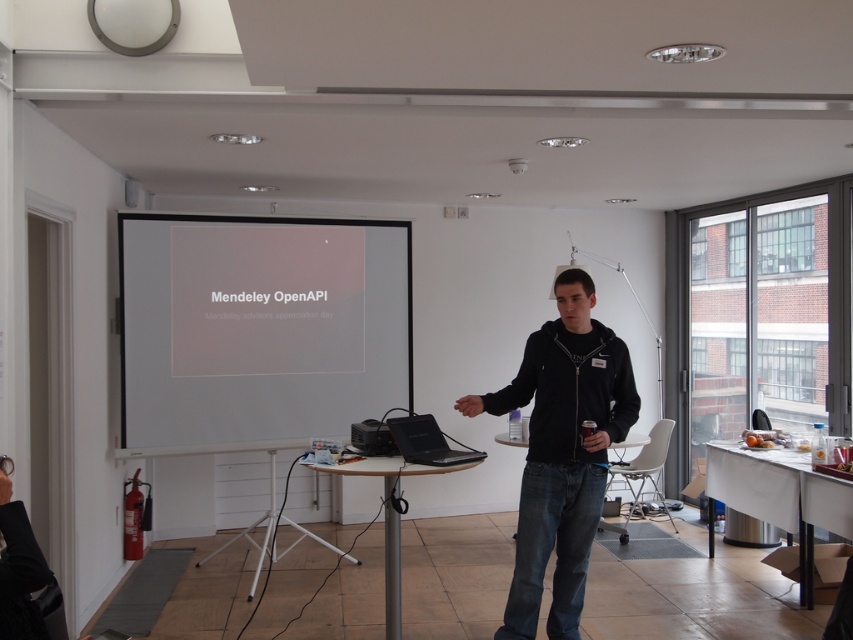
Looking at this image, who is shorter, white matte projection screen at center or black plastic projector at center?

Standing shorter between the two is black plastic projector at center.

Does white matte projection screen at center have a larger size compared to black plastic projector at center?

Correct, white matte projection screen at center is larger in size than black plastic projector at center.

Is point (219, 355) farther from camera compared to point (366, 452)?

Yes, point (219, 355) is behind point (366, 452).

Where is `white matte projection screen at center`? Image resolution: width=853 pixels, height=640 pixels. white matte projection screen at center is located at coordinates (258, 330).

Does black matte jacket at center have a smaller size compared to black plastic projector at center?

No.

Is black matte jacket at center wider than black plastic projector at center?

Yes.

Between point (532, 502) and point (364, 435), which one is positioned in front?

Point (532, 502) is more forward.

Locate an element on the screen. The width and height of the screenshot is (853, 640). black matte jacket at center is located at coordinates (561, 452).

Can you confirm if white matte projection screen at center is positioned above black matte jacket at center?

Indeed, white matte projection screen at center is positioned over black matte jacket at center.

I want to click on white matte projection screen at center, so click(x=258, y=330).